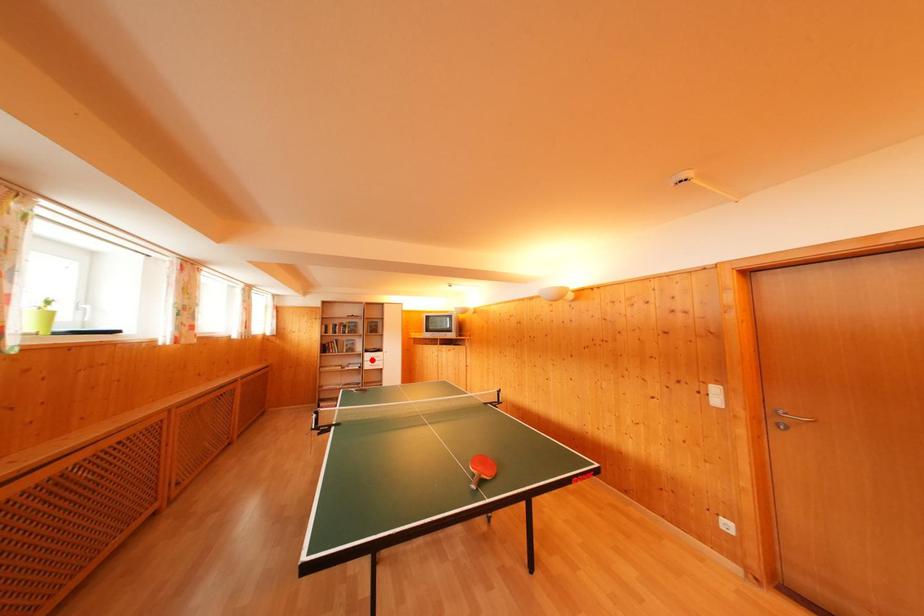
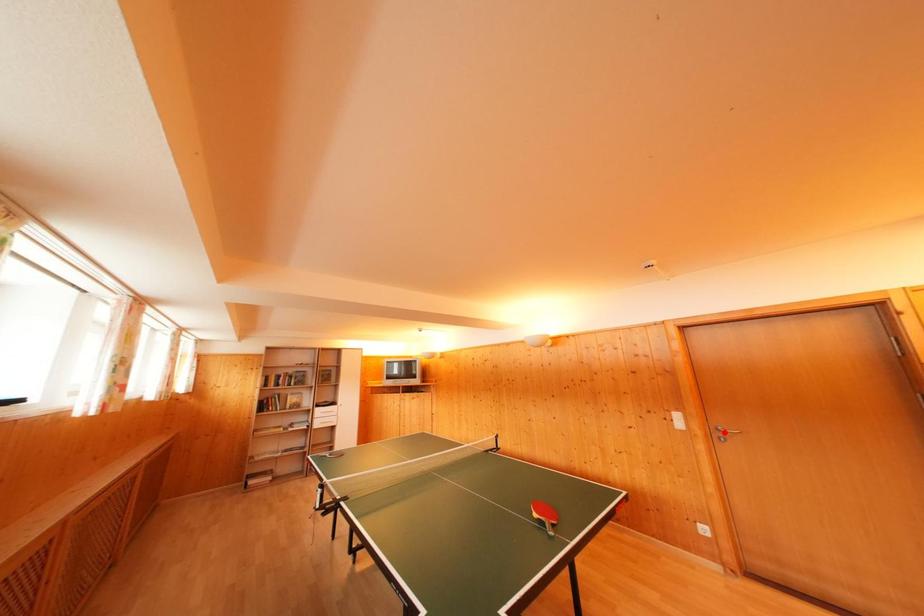
I am providing you with two images of the same scene from different viewpoints. A red point is marked on the first image and another point is marked on the second image. Does the point marked in image1 correspond to the same location as the one in image2?

No